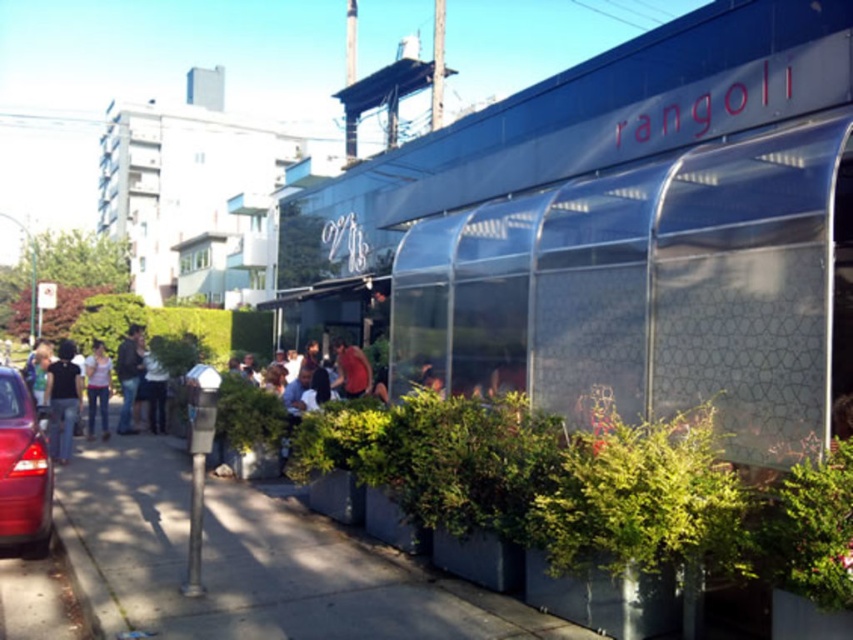
Question: Does matte black shirt at left come behind dark blue jeans at center?

Choices:
 (A) yes
 (B) no

Answer: (B)

Question: Is denim jeans at left positioned at the back of dark blue jeans at center?

Choices:
 (A) no
 (B) yes

Answer: (A)

Question: Which point is farther to the camera?

Choices:
 (A) (102, 429)
 (B) (56, 476)
 (C) (343, 339)
 (D) (146, 371)

Answer: (C)

Question: Which object is closer to the camera taking this photo?

Choices:
 (A) shiny red car at lower left
 (B) denim jeans at left

Answer: (A)

Question: Estimate the real-world distances between objects in this image. Which object is closer to the denim jacket at left?

Choices:
 (A) dark blue jeans at center
 (B) red fabric shirt at center
 (C) matte black shirt at left
 (D) gray concrete sidewalk at lower left

Answer: (A)

Question: Does shiny red car at lower left appear under red fabric shirt at center?

Choices:
 (A) yes
 (B) no

Answer: (A)